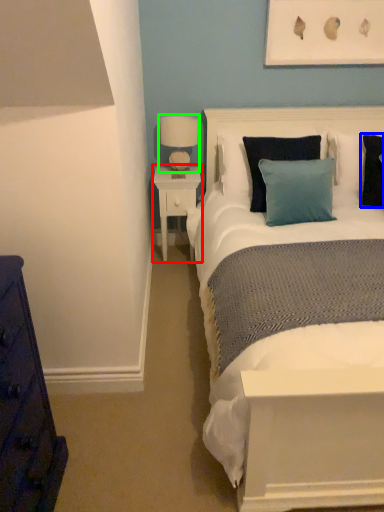
Question: Estimate the real-world distances between objects in this image. Which object is farther from nightstand (highlighted by a red box), pillow (highlighted by a blue box) or table lamp (highlighted by a green box)?

Choices:
 (A) pillow
 (B) table lamp

Answer: (A)